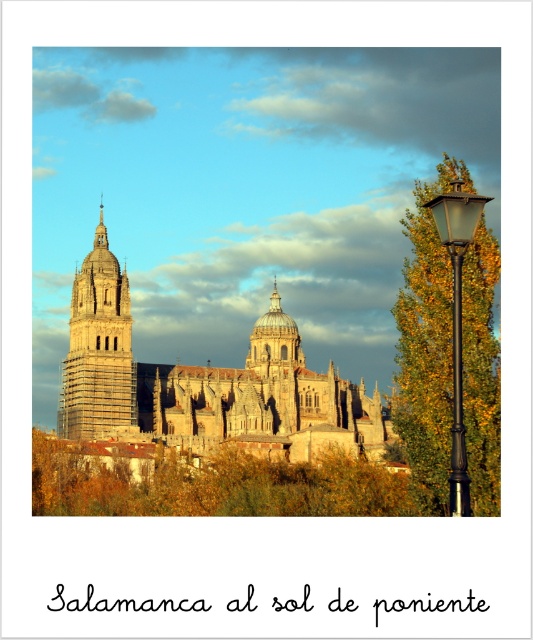
You are standing in front of the Salamanca Cathedral and looking at two points marked in the image. The first point is at coordinates point (318, 486) and the second is at point (458, 492). Which point is closer to you?

Point (318, 486) is closer to you because it is further to the viewer than point (458, 492).